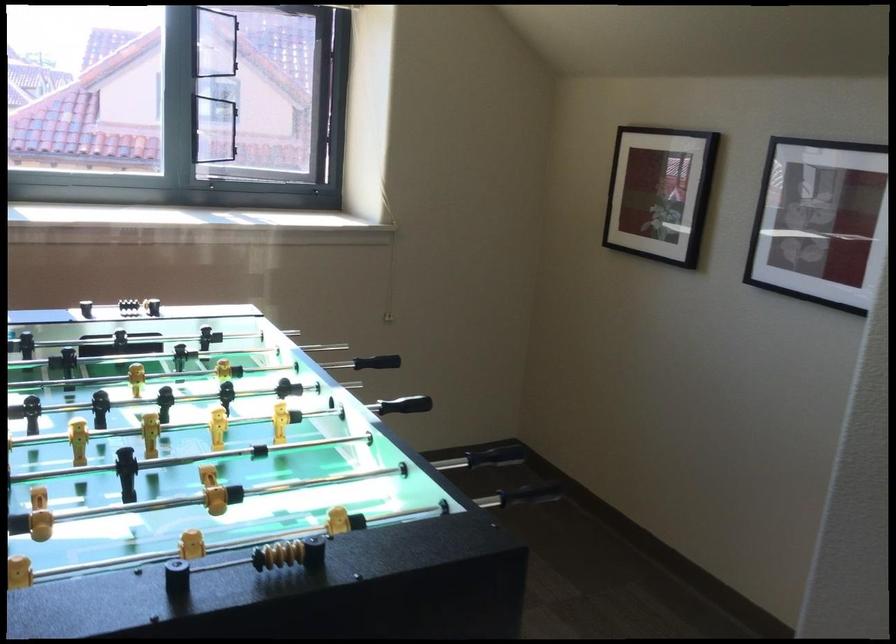
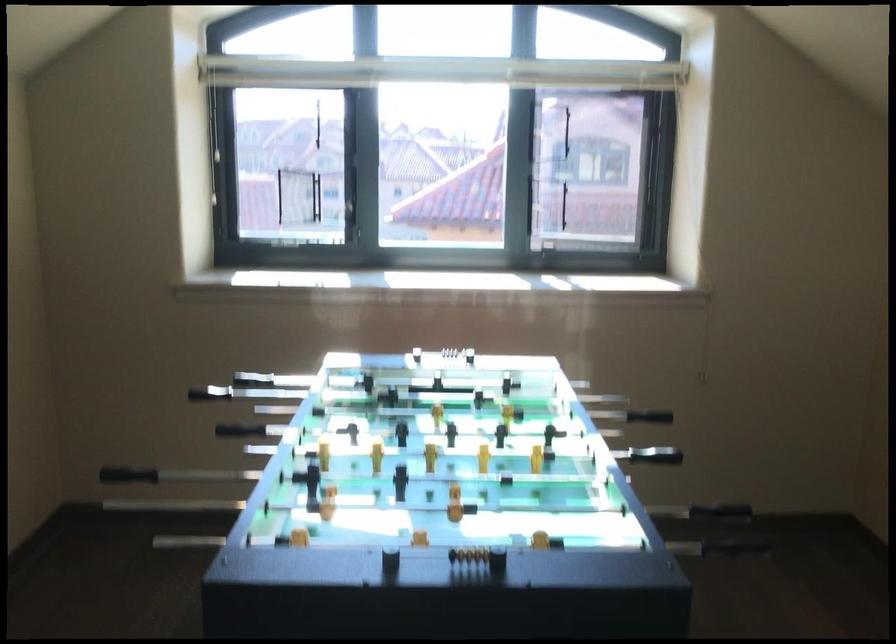
Locate, in the second image, the point that corresponds to (497,453) in the first image.

(724, 514)